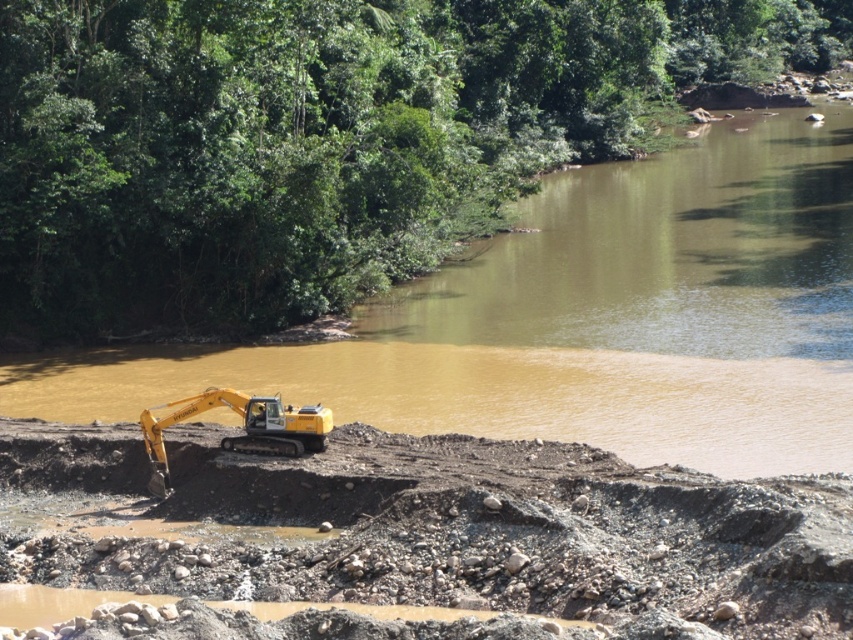
Which is in front, point (590, 211) or point (256, 444)?

Positioned in front is point (256, 444).

Is brown muddy water at center to the right of yellow rubber excavator at lower left from the viewer's perspective?

Yes, brown muddy water at center is to the right of yellow rubber excavator at lower left.

The width and height of the screenshot is (853, 640). What do you see at coordinates (584, 320) in the screenshot? I see `brown muddy water at center` at bounding box center [584, 320].

Where is `brown muddy water at center`? brown muddy water at center is located at coordinates (584, 320).

From the picture: Who is lower down, yellow tracked excavator at lower left or yellow rubber excavator at lower left?

Positioned lower is yellow tracked excavator at lower left.

You are a GUI agent. You are given a task and a screenshot of the screen. Output one action in this format:
    pyautogui.click(x=<x>, y=<y>)
    Task: Click on the yellow tracked excavator at lower left
    
    Given the screenshot: What is the action you would take?
    pyautogui.click(x=495, y=532)

Who is positioned more to the right, brown muddy water at center or yellow tracked excavator at lower left?

From the viewer's perspective, brown muddy water at center appears more on the right side.

Is point (834, 289) less distant than point (202, 545)?

That is False.

The width and height of the screenshot is (853, 640). What do you see at coordinates (584, 320) in the screenshot?
I see `brown muddy water at center` at bounding box center [584, 320].

Identify the location of brown muddy water at center. (584, 320).